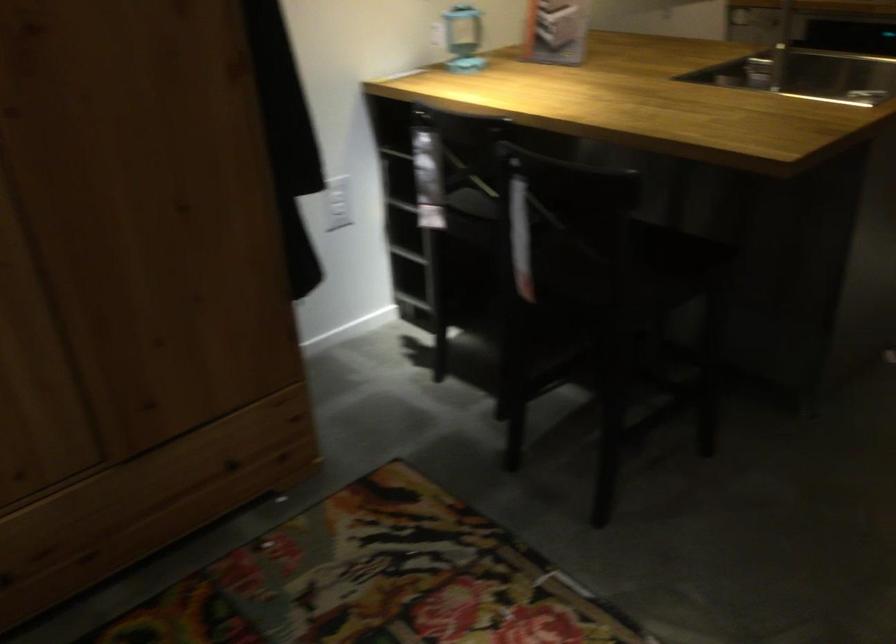
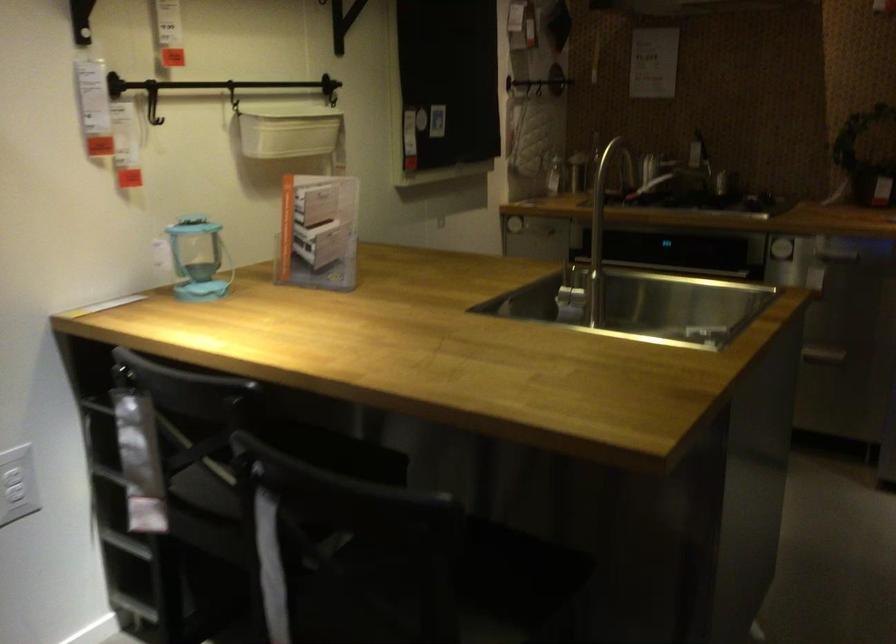
In the second image, find the point that corresponds to (x=625, y=236) in the first image.

(444, 590)